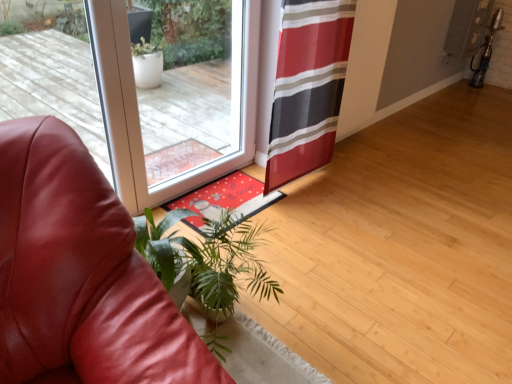
What do you see at coordinates (308, 87) in the screenshot?
I see `red and black striped curtain at center` at bounding box center [308, 87].

Measure the distance between point (66, 364) and camera.

Point (66, 364) and camera are 3.50 feet apart from each other.

Identify the location of green leafy plant at lower left. (x=208, y=257).

Is red and black striped curtain at center facing away from leather couch at lower left?

No, red and black striped curtain at center is not facing the opposite direction of leather couch at lower left.

Between red and black striped curtain at center and leather couch at lower left, which one has larger size?

With larger size is leather couch at lower left.

Considering the points (303, 73) and (85, 275), which point is in front, point (303, 73) or point (85, 275)?

Point (85, 275)

Considering the relative positions of red and black striped curtain at center and leather couch at lower left in the image provided, is red and black striped curtain at center in front of leather couch at lower left?

No.

Is red and black striped curtain at center positioned beyond the bounds of transparent glass door at center?

Absolutely, red and black striped curtain at center is external to transparent glass door at center.

Considering the sizes of objects red and black striped curtain at center and transparent glass door at center in the image provided, who is taller, red and black striped curtain at center or transparent glass door at center?

Standing taller between the two is transparent glass door at center.

Can you tell me how much green leafy plant at lower left and red and black striped curtain at center differ in facing direction?

green leafy plant at lower left and red and black striped curtain at center are facing 5.98 degrees away from each other.

Between green leafy plant at lower left and red and black striped curtain at center, which one appears on the right side from the viewer's perspective?

red and black striped curtain at center is more to the right.

Does point (222, 218) come farther from viewer compared to point (269, 149)?

No, (222, 218) is closer to viewer.

Between green leafy plant at lower left and red and black striped curtain at center, which one has larger width?

With larger width is green leafy plant at lower left.

Considering the sizes of objects transparent glass door at center and green leafy plant at lower left in the image provided, who is shorter, transparent glass door at center or green leafy plant at lower left?

green leafy plant at lower left.

From the picture: Is transparent glass door at center in front of or behind green leafy plant at lower left in the image?

In the image, transparent glass door at center appears behind green leafy plant at lower left.

Is transparent glass door at center bigger than green leafy plant at lower left?

Correct, transparent glass door at center is larger in size than green leafy plant at lower left.

Does transparent glass door at center have a greater width compared to green leafy plant at lower left?

No, transparent glass door at center is not wider than green leafy plant at lower left.

From a real-world perspective, is leather couch at lower left physically located above or below green leafy plant at lower left?

In terms of real-world spatial position, leather couch at lower left is above green leafy plant at lower left.

From the picture: Considering the sizes of objects leather couch at lower left and green leafy plant at lower left in the image provided, who is thinner, leather couch at lower left or green leafy plant at lower left?

green leafy plant at lower left.

Could you tell me if leather couch at lower left is facing green leafy plant at lower left?

No, leather couch at lower left is not aimed at green leafy plant at lower left.

Is the depth of green leafy plant at lower left greater than that of leather couch at lower left?

Yes, the depth of green leafy plant at lower left is greater than that of leather couch at lower left.

Considering the positions of objects green leafy plant at lower left and leather couch at lower left in the image provided, who is more to the right, green leafy plant at lower left or leather couch at lower left?

green leafy plant at lower left.

Which of these two, green leafy plant at lower left or leather couch at lower left, is smaller?

Smaller between the two is green leafy plant at lower left.

From the image's perspective, is transparent glass door at center positioned above or below red and black striped curtain at center?

Based on their image positions, transparent glass door at center is located beneath red and black striped curtain at center.

Considering the points (145, 96) and (288, 124), which point is in front, point (145, 96) or point (288, 124)?

The point (288, 124) is more forward.

Does transparent glass door at center appear on the right side of red and black striped curtain at center?

No.

How different are the orientations of transparent glass door at center and red and black striped curtain at center in degrees?

The angular difference between transparent glass door at center and red and black striped curtain at center is 1.91 degrees.

Locate an element on the screen. This screenshot has height=384, width=512. chair in front of the red and black striped curtain at center is located at coordinates (80, 274).

In the image, there is a transparent glass door at center. Where is `curtain above it (from the image's perspective)`? The width and height of the screenshot is (512, 384). curtain above it (from the image's perspective) is located at coordinates (308, 87).

Considering their positions, is red and black striped curtain at center positioned closer to leather couch at lower left than transparent glass door at center?

transparent glass door at center.

When comparing their distances from red and black striped curtain at center, does leather couch at lower left or transparent glass door at center seem closer?

transparent glass door at center.

Based on their spatial positions, is leather couch at lower left or green leafy plant at lower left closer to red and black striped curtain at center?

green leafy plant at lower left is positioned closer to the anchor red and black striped curtain at center.

Considering their positions, is red and black striped curtain at center positioned further to green leafy plant at lower left than leather couch at lower left?

The object further to green leafy plant at lower left is red and black striped curtain at center.

Based on the photo, based on their spatial positions, is transparent glass door at center or leather couch at lower left closer to red and black striped curtain at center?

transparent glass door at center lies closer to red and black striped curtain at center than the other object.

When comparing their distances from transparent glass door at center, does red and black striped curtain at center or leather couch at lower left seem further?

leather couch at lower left.

Based on their spatial positions, is green leafy plant at lower left or leather couch at lower left further from transparent glass door at center?

Among the two, leather couch at lower left is located further to transparent glass door at center.

When comparing their distances from transparent glass door at center, does leather couch at lower left or red and black striped curtain at center seem closer?

Based on the image, red and black striped curtain at center appears to be nearer to transparent glass door at center.

The width and height of the screenshot is (512, 384). Identify the location of door located between leather couch at lower left and red and black striped curtain at center in the depth direction. (139, 88).

The height and width of the screenshot is (384, 512). I want to click on houseplant between leather couch at lower left and red and black striped curtain at center from front to back, so click(208, 257).

You are a GUI agent. You are given a task and a screenshot of the screen. Output one action in this format:
    pyautogui.click(x=<x>, y=<y>)
    Task: Click on the door between red and black striped curtain at center and green leafy plant at lower left vertically
    
    Given the screenshot: What is the action you would take?
    pyautogui.click(x=139, y=88)

Locate an element on the screen. houseplant located between leather couch at lower left and transparent glass door at center in the depth direction is located at coordinates (208, 257).